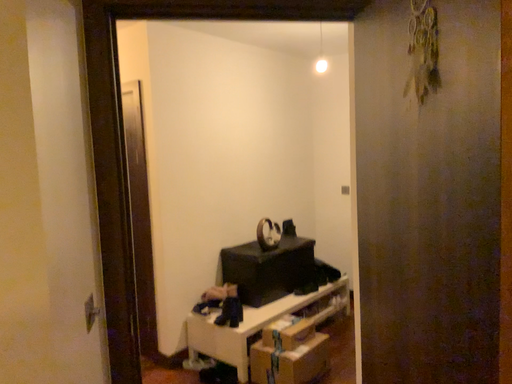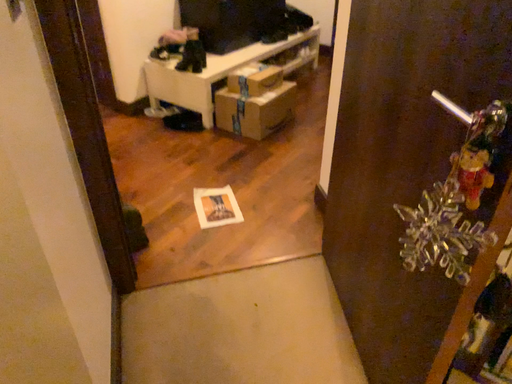
Question: Which way did the camera rotate in the video?

Choices:
 (A) rotated upward
 (B) rotated downward

Answer: (B)